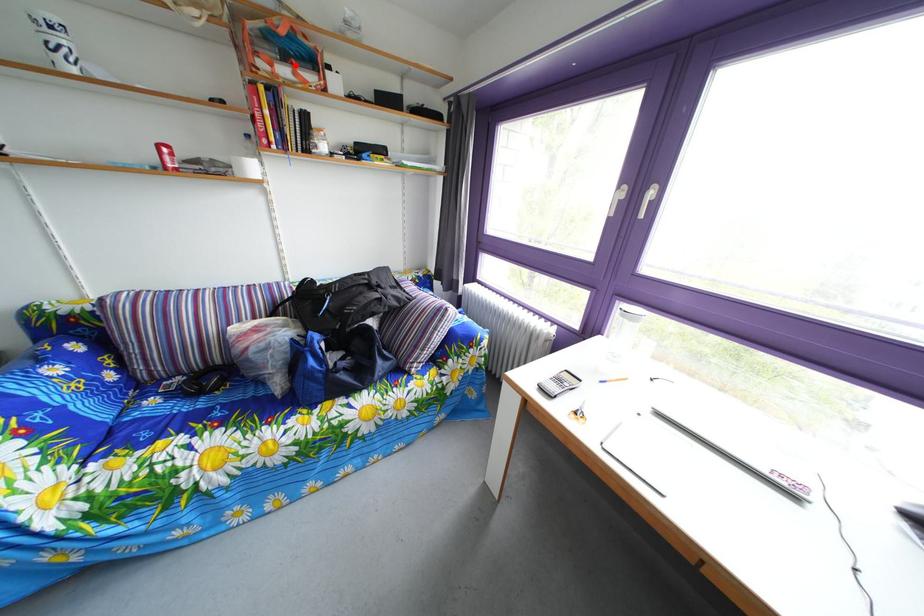
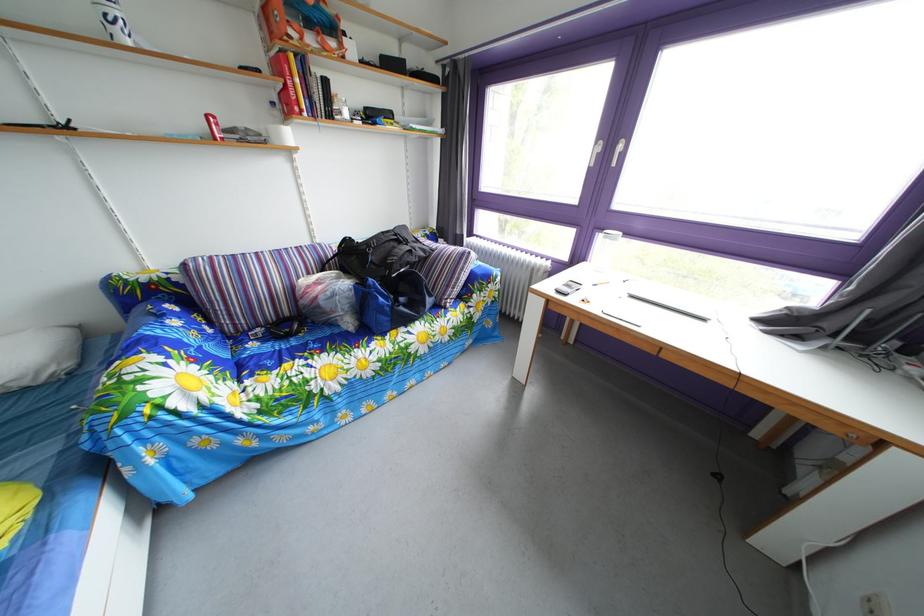
Find the pixel in the second image that matches the highlighted location in the first image.

(320, 33)